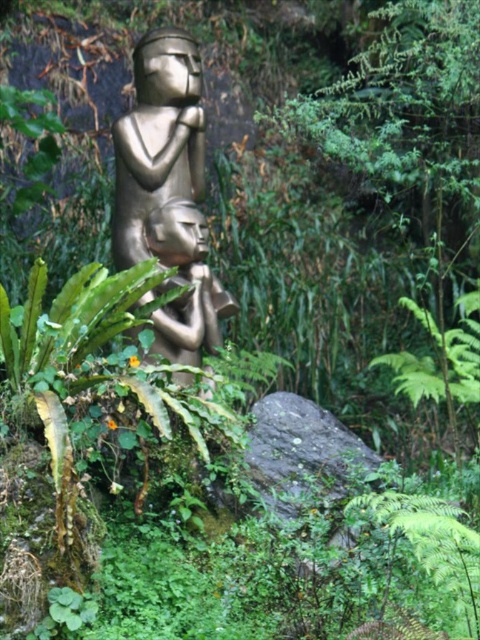
Question: Can you confirm if gold polished statue at center is wider than gold metallic figurine at center?

Choices:
 (A) yes
 (B) no

Answer: (A)

Question: Which object is farther from the camera taking this photo?

Choices:
 (A) gold metallic figurine at center
 (B) gold polished statue at center

Answer: (A)

Question: Is the position of gold polished statue at center less distant than that of gold metallic figurine at center?

Choices:
 (A) no
 (B) yes

Answer: (B)

Question: Does gold polished statue at center appear under gold metallic figurine at center?

Choices:
 (A) no
 (B) yes

Answer: (A)

Question: Which object appears farthest from the camera in this image?

Choices:
 (A) gold polished statue at center
 (B) gold metallic figurine at center

Answer: (B)